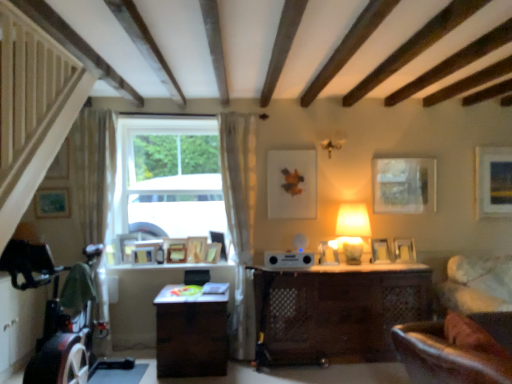
This screenshot has width=512, height=384. What are the coordinates of `free point above dark wood table at center (from a real-world perspective)` in the screenshot? It's located at (188, 289).